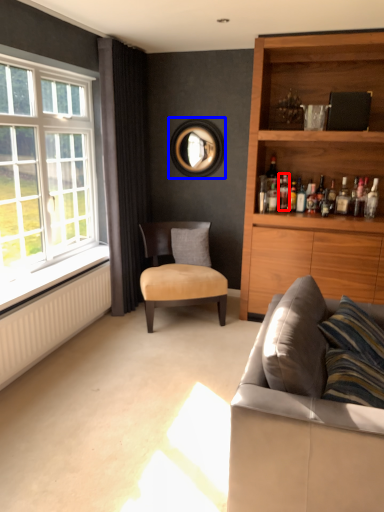
Question: Which of the following is the closest to the observer, bottle (highlighted by a red box) or picture frame (highlighted by a blue box)?

Choices:
 (A) bottle
 (B) picture frame

Answer: (A)